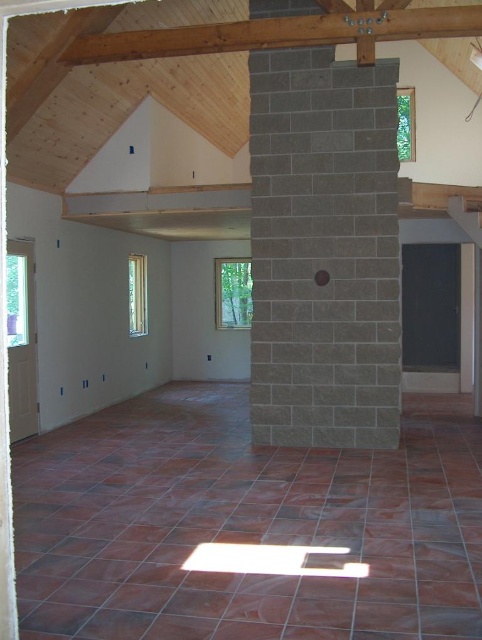
Question: Is gray stone pillar at center above brown wooden beam at upper center?

Choices:
 (A) no
 (B) yes

Answer: (A)

Question: Is gray stone pillar at center positioned at the back of brown wooden beam at upper center?

Choices:
 (A) yes
 (B) no

Answer: (A)

Question: Does gray stone pillar at center appear under brown wooden beam at upper center?

Choices:
 (A) no
 (B) yes

Answer: (B)

Question: Which object appears closest to the camera in this image?

Choices:
 (A) brown wooden beam at upper center
 (B) gray stone pillar at center

Answer: (A)

Question: Which object appears farthest from the camera in this image?

Choices:
 (A) brown wooden beam at upper center
 (B) gray stone pillar at center

Answer: (B)